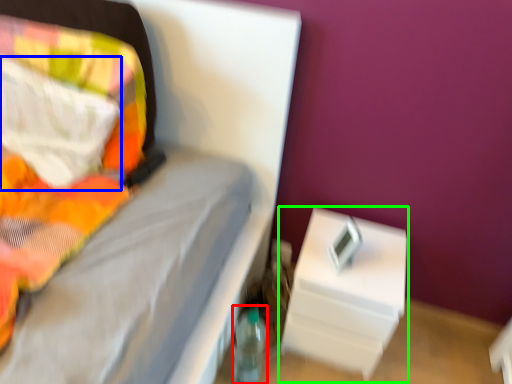
Question: Based on their relative distances, which object is farther from bottle (highlighted by a red box)? Choose from pillow (highlighted by a blue box) and nightstand (highlighted by a green box).

Choices:
 (A) pillow
 (B) nightstand

Answer: (A)